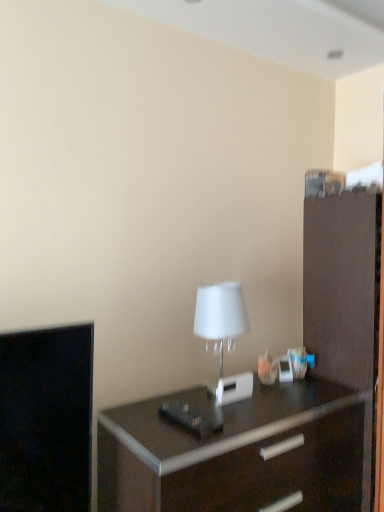
Where is `space that is in front of white matte table lamp at center`? The width and height of the screenshot is (384, 512). space that is in front of white matte table lamp at center is located at coordinates (243, 420).